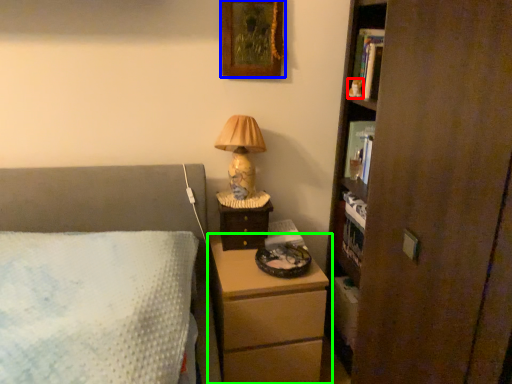
Question: Estimate the real-world distances between objects in this image. Which object is farther from toy (highlighted by a red box), picture frame (highlighted by a blue box) or chest of drawers (highlighted by a green box)?

Choices:
 (A) picture frame
 (B) chest of drawers

Answer: (B)